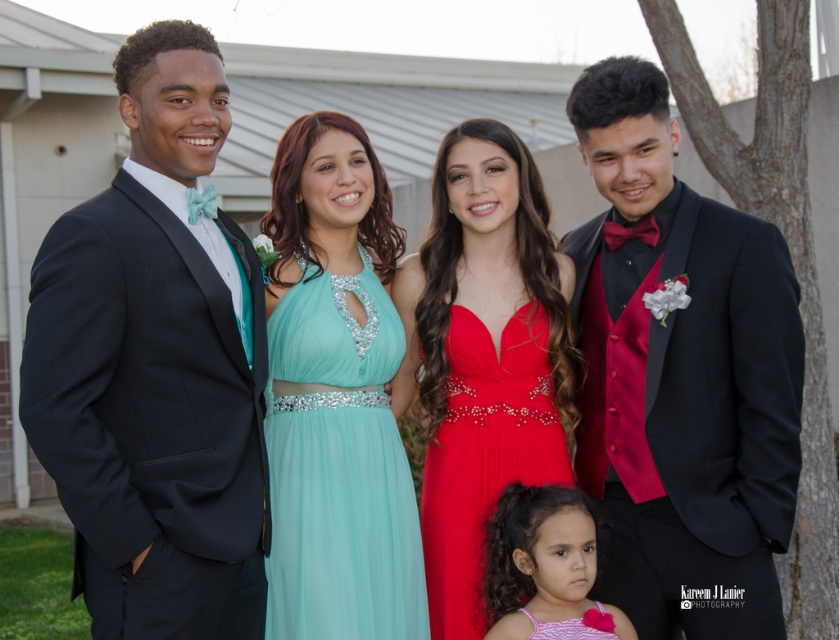
Is shiny black suit at right further to the viewer compared to tulle/aqua dress at center?

No, it is in front of tulle/aqua dress at center.

Between shiny black suit at right and tulle/aqua dress at center, which one appears on the right side from the viewer's perspective?

From the viewer's perspective, shiny black suit at right appears more on the right side.

Find the location of a particular element. The width and height of the screenshot is (839, 640). shiny black suit at right is located at coordinates (681, 378).

Can you confirm if matte black suit at left is positioned above pink satin dress at lower center?

Correct, matte black suit at left is located above pink satin dress at lower center.

Which is more to the right, matte black suit at left or pink satin dress at lower center?

From the viewer's perspective, pink satin dress at lower center appears more on the right side.

Which is in front, point (90, 609) or point (618, 628)?

Positioned in front is point (90, 609).

This screenshot has height=640, width=839. What are the coordinates of `matte black suit at left` in the screenshot? It's located at (155, 365).

Is matte black suit at left wider than shiny satin dress at center?

Yes, matte black suit at left is wider than shiny satin dress at center.

Who is more forward, (43, 291) or (446, 420)?

Point (43, 291)

Where is `matte black suit at left`? Image resolution: width=839 pixels, height=640 pixels. matte black suit at left is located at coordinates (155, 365).